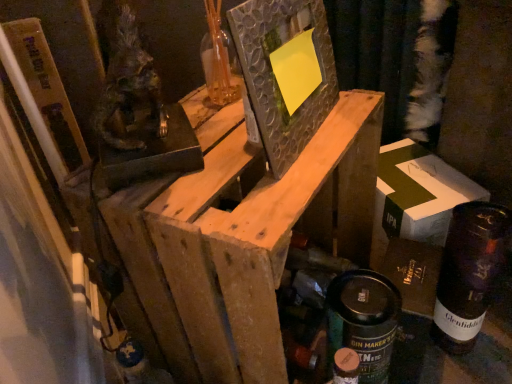
Question: Based on their positions, is white cardboard box at right located to the left or right of dark glass bottle at lower right?

Choices:
 (A) left
 (B) right

Answer: (A)

Question: In the image, is white cardboard box at right positioned in front of or behind dark glass bottle at lower right?

Choices:
 (A) front
 (B) behind

Answer: (B)

Question: Estimate the real-world distances between objects in this image. Which object is closer to the matte black spray can at lower right?

Choices:
 (A) wooden frame at center
 (B) white cardboard box at right
 (C) textured glass picture frame at center
 (D) dark glass bottle at lower right

Answer: (D)

Question: Which of these objects is positioned closest to the matte black spray can at lower right?

Choices:
 (A) wooden frame at center
 (B) textured glass picture frame at center
 (C) white cardboard box at right
 (D) dark glass bottle at lower right

Answer: (D)